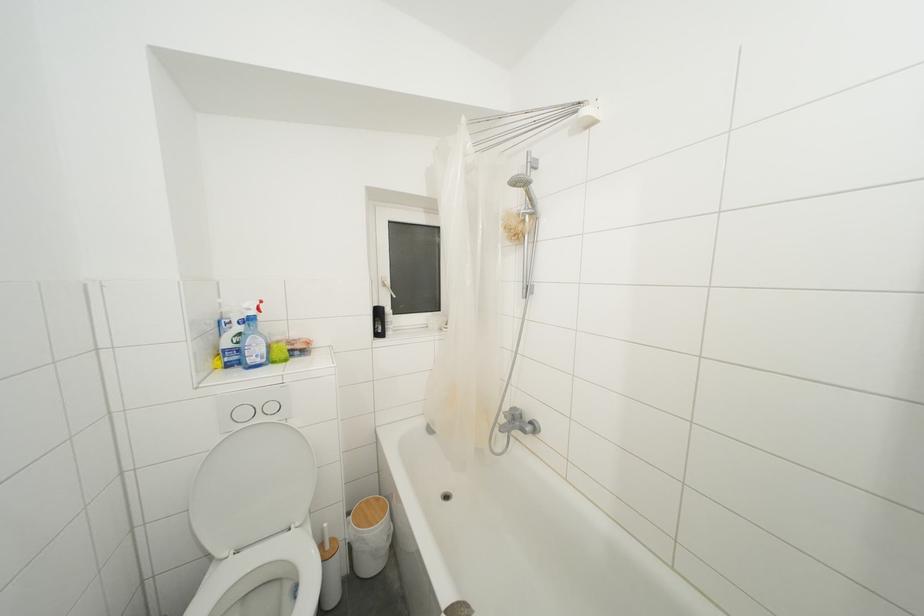
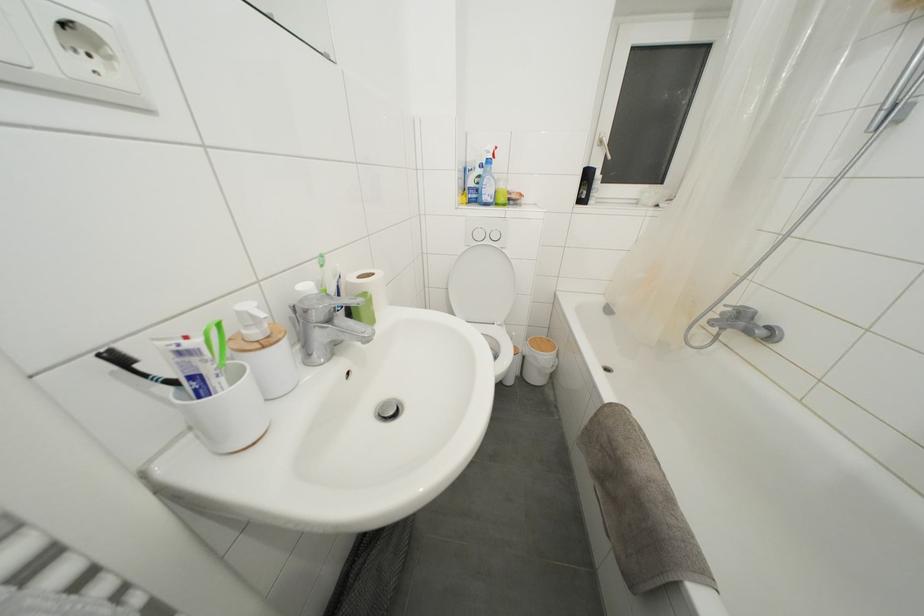
Find the pixel in the second image that matches [388,290] in the first image.

(604, 148)